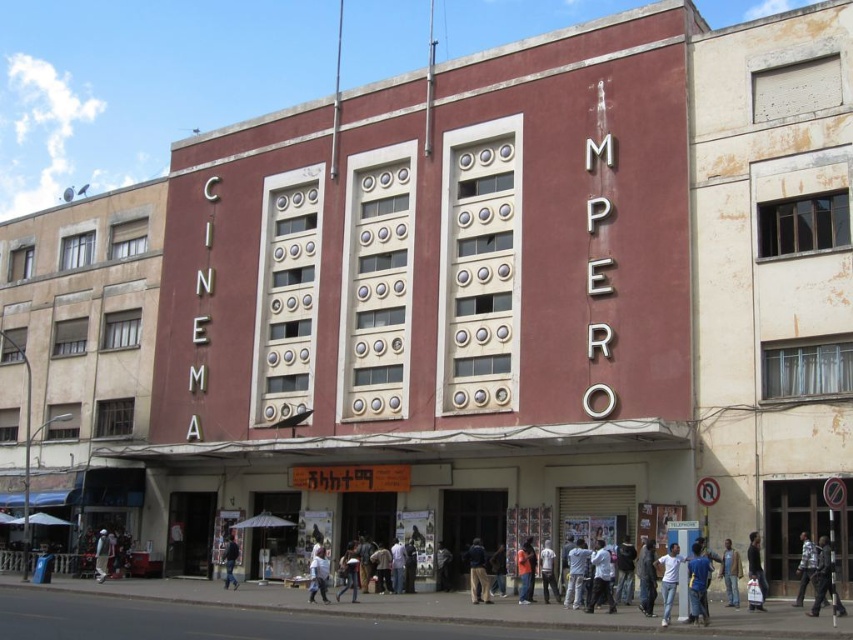
Question: Which object is the closest to the dark blue uniform at lower right?

Choices:
 (A) dark blue fabric bag at lower right
 (B) denim pants at lower center

Answer: (A)

Question: Can you confirm if dark blue jeans at lower right is smaller than denim pants at lower center?

Choices:
 (A) yes
 (B) no

Answer: (A)

Question: Which of the following is the closest to the observer?

Choices:
 (A) (485, 580)
 (B) (437, 588)
 (C) (724, 540)
 (D) (102, 541)

Answer: (C)

Question: Estimate the real-world distances between objects in this image. Which object is farther from the denim pants at lower center?

Choices:
 (A) orange fabric jacket at center
 (B) dark blue uniform at lower right
 (C) dark blue fabric at center

Answer: (B)

Question: Does denim pants at lower center appear on the right side of dark blue jeans at center?

Choices:
 (A) no
 (B) yes

Answer: (A)

Question: Is orange fabric jacket at center in front of dark gray fabric jacket at lower center?

Choices:
 (A) no
 (B) yes

Answer: (B)